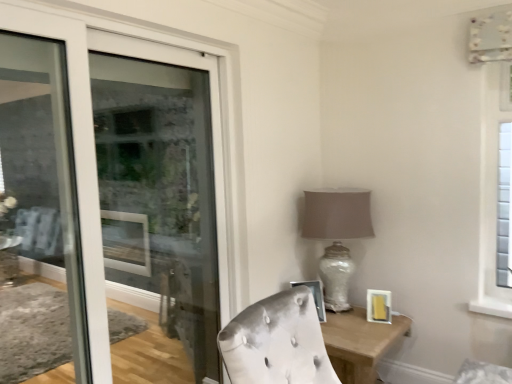
Question: Considering the relative sizes of metallic silver picture frame at center, arranged as the 2th picture frame when viewed from the right, and wooden table at lower right in the image provided, is metallic silver picture frame at center, arranged as the 2th picture frame when viewed from the right, thinner than wooden table at lower right?

Choices:
 (A) no
 (B) yes

Answer: (B)

Question: Does metallic silver picture frame at center, which is the 1th picture frame in left-to-right order, lie in front of wooden table at lower right?

Choices:
 (A) no
 (B) yes

Answer: (A)

Question: Is metallic silver picture frame at center, which is the 1th picture frame in left-to-right order, outside of wooden table at lower right?

Choices:
 (A) no
 (B) yes

Answer: (B)

Question: Is metallic silver picture frame at center, which is the 1th picture frame in left-to-right order, bigger than wooden table at lower right?

Choices:
 (A) no
 (B) yes

Answer: (A)

Question: Is metallic silver picture frame at center, which is the 1th picture frame in left-to-right order, oriented towards wooden table at lower right?

Choices:
 (A) yes
 (B) no

Answer: (B)

Question: Would you say metallic silver picture frame at center, arranged as the 2th picture frame when viewed from the right, is to the left or to the right of matte gold picture frame at lower right, acting as the second picture frame starting from the left, in the picture?

Choices:
 (A) left
 (B) right

Answer: (A)

Question: Based on their sizes in the image, would you say metallic silver picture frame at center, arranged as the 2th picture frame when viewed from the right, is bigger or smaller than matte gold picture frame at lower right, which is the 1th picture frame from right to left?

Choices:
 (A) big
 (B) small

Answer: (A)

Question: In terms of height, does metallic silver picture frame at center, arranged as the 2th picture frame when viewed from the right, look taller or shorter compared to matte gold picture frame at lower right, acting as the second picture frame starting from the left?

Choices:
 (A) short
 (B) tall

Answer: (B)

Question: From the image's perspective, is metallic silver picture frame at center, arranged as the 2th picture frame when viewed from the right, positioned above or below matte gold picture frame at lower right, acting as the second picture frame starting from the left?

Choices:
 (A) below
 (B) above

Answer: (B)

Question: In terms of width, does matte glass door at left look wider or thinner when compared to wooden table at lower right?

Choices:
 (A) thin
 (B) wide

Answer: (A)

Question: From the image's perspective, is matte glass door at left located above or below wooden table at lower right?

Choices:
 (A) below
 (B) above

Answer: (B)

Question: Considering the positions of point (46, 4) and point (339, 370), is point (46, 4) closer or farther from the camera than point (339, 370)?

Choices:
 (A) farther
 (B) closer

Answer: (B)

Question: Considering the relative positions of matte glass door at left and wooden table at lower right in the image provided, is matte glass door at left to the left or to the right of wooden table at lower right?

Choices:
 (A) left
 (B) right

Answer: (A)

Question: Based on their sizes in the image, would you say matte glass door at left is bigger or smaller than matte glass table lamp at center-right?

Choices:
 (A) big
 (B) small

Answer: (A)

Question: Is matte glass door at left spatially inside matte glass table lamp at center-right, or outside of it?

Choices:
 (A) inside
 (B) outside

Answer: (B)